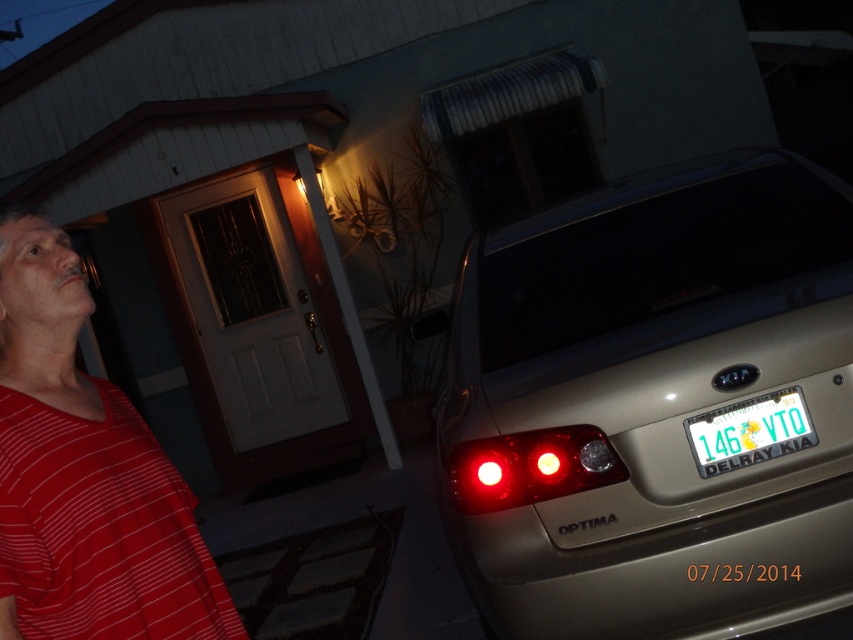
Who is more forward, [476,484] or [776,422]?

Point [776,422] is more forward.

Locate an element on the screen. The height and width of the screenshot is (640, 853). matte plastic brake light at lower right is located at coordinates (529, 467).

Between matte plastic brake light at lower right and red glass light at center, which one appears on the left side from the viewer's perspective?

matte plastic brake light at lower right is more to the left.

This screenshot has width=853, height=640. What do you see at coordinates (529, 467) in the screenshot?
I see `matte plastic brake light at lower right` at bounding box center [529, 467].

Where is `matte plastic brake light at lower right`? matte plastic brake light at lower right is located at coordinates (529, 467).

At what (x,y) coordinates should I click in order to perform the action: click on matte plastic brake light at lower right. Please return your answer as a coordinate pair (x, y). The width and height of the screenshot is (853, 640). Looking at the image, I should click on pyautogui.click(x=529, y=467).

Which is behind, point (16, 224) or point (476, 476)?

The point (476, 476) is behind.

Which is more to the left, red striped shirt at left or red translucent light at center?

red striped shirt at left

Is point (64, 289) in front of point (479, 468)?

Yes, it is.

The width and height of the screenshot is (853, 640). Identify the location of red striped shirt at left. (84, 476).